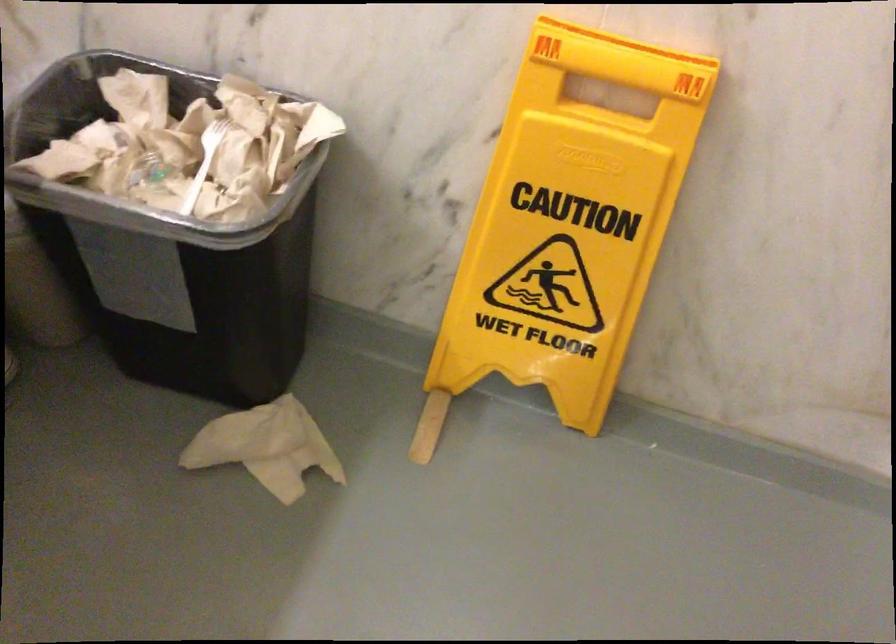
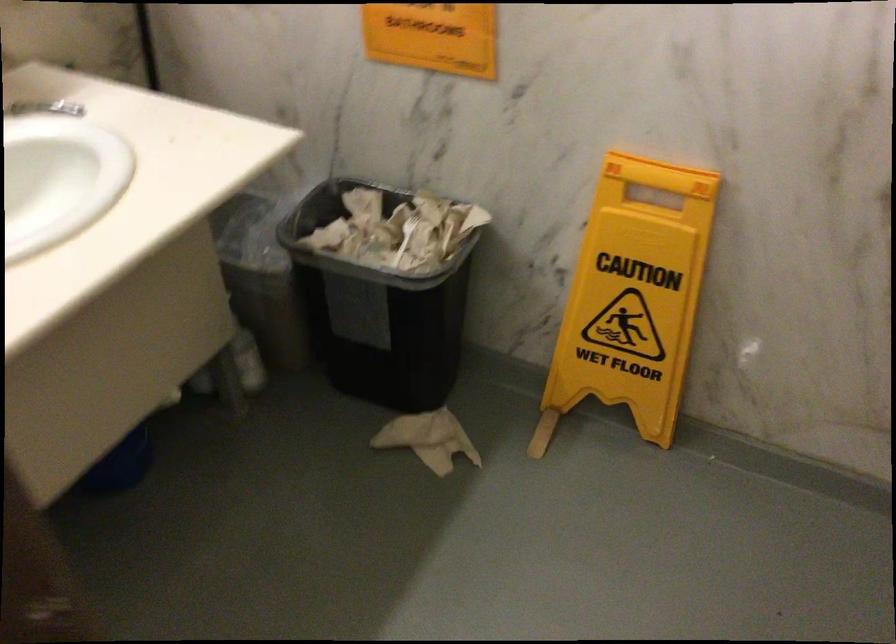
The point at (618,67) is marked in the first image. Where is the corresponding point in the second image?

(659, 175)